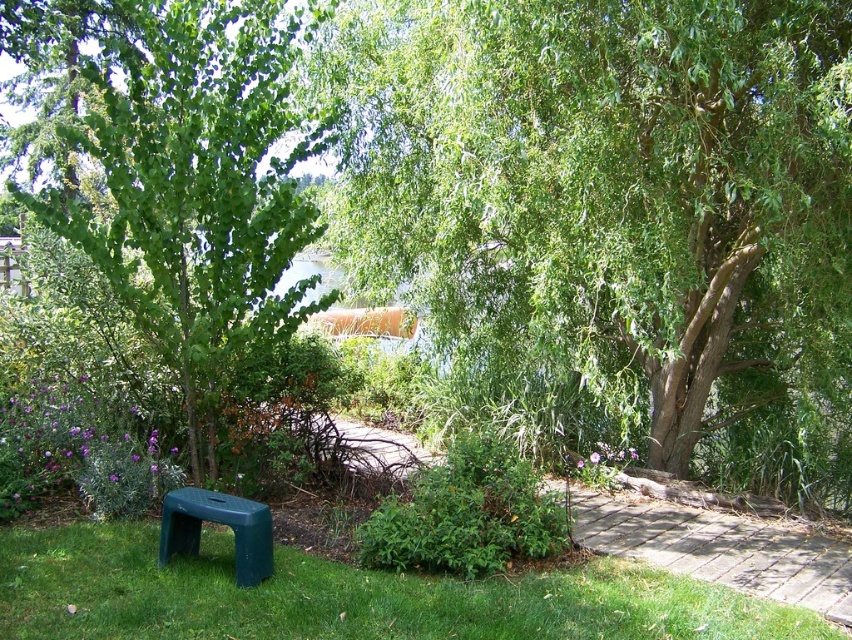
Is green leafy tree at left wider than brick paved path at center?

Indeed, green leafy tree at left has a greater width compared to brick paved path at center.

What do you see at coordinates (193, 180) in the screenshot? This screenshot has width=852, height=640. I see `green leafy tree at left` at bounding box center [193, 180].

This screenshot has height=640, width=852. I want to click on green leafy tree at left, so click(193, 180).

Between brick paved path at center and green plastic bench at lower left, which one has less height?

Standing shorter between the two is brick paved path at center.

The width and height of the screenshot is (852, 640). What do you see at coordinates (718, 548) in the screenshot?
I see `brick paved path at center` at bounding box center [718, 548].

The width and height of the screenshot is (852, 640). I want to click on brick paved path at center, so click(718, 548).

Is green leafy tree at upper right shorter than green plastic bench at lower left?

No, green leafy tree at upper right is not shorter than green plastic bench at lower left.

Which is below, green leafy tree at upper right or green plastic bench at lower left?

Positioned lower is green plastic bench at lower left.

I want to click on green leafy tree at upper right, so click(x=607, y=189).